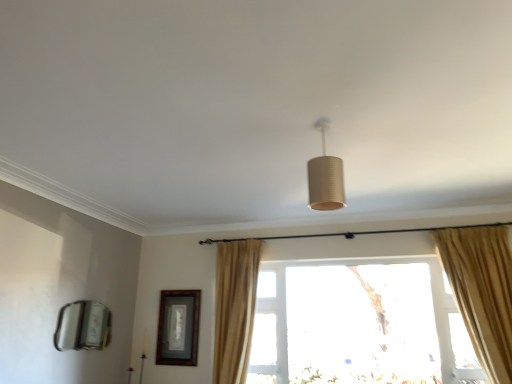
The image size is (512, 384). Describe the element at coordinates (234, 307) in the screenshot. I see `transparent glass window at center` at that location.

Where is `wooden framed picture at center left`? This screenshot has width=512, height=384. wooden framed picture at center left is located at coordinates (178, 327).

Which is behind, matte cardboard lampshade at center or transparent glass window at center?

transparent glass window at center is more distant.

Consider the image. Is matte cardboard lampshade at center facing towards transparent glass window at center?

No.

Can you confirm if matte cardboard lampshade at center is wider than transparent glass window at center?

Correct, the width of matte cardboard lampshade at center exceeds that of transparent glass window at center.

Is wooden framed picture at center left directly adjacent to beige fabric curtain at center?

There is a gap between wooden framed picture at center left and beige fabric curtain at center.

Which object is closer to the camera taking this photo, wooden framed picture at center left or beige fabric curtain at center?

Positioned in front is beige fabric curtain at center.

Considering the sizes of objects wooden framed picture at center left and beige fabric curtain at center in the image provided, who is smaller, wooden framed picture at center left or beige fabric curtain at center?

Smaller between the two is wooden framed picture at center left.

What's the angular difference between wooden framed picture at center left and beige fabric curtain at center's facing directions?

They differ by 0.857 degrees in their facing directions.

Is the depth of transparent glass window at center greater than that of wooden framed picture at center left?

No, transparent glass window at center is closer to the viewer.

From the image's perspective, is transparent glass window at center beneath wooden framed picture at center left?

No, from the image's perspective, transparent glass window at center is not beneath wooden framed picture at center left.

Does transparent glass window at center have a larger size compared to wooden framed picture at center left?

Yes.

In terms of height, does transparent glass window at center look taller or shorter compared to wooden framed picture at center left?

transparent glass window at center is taller than wooden framed picture at center left.

How different are the orientations of transparent glass window at center and matte cardboard lampshade at center in degrees?

The facing directions of transparent glass window at center and matte cardboard lampshade at center are 5.43 degrees apart.

Can you see transparent glass window at center touching matte cardboard lampshade at center?

No, transparent glass window at center is not next to matte cardboard lampshade at center.

Which point is more forward, (219, 313) or (324, 153)?

Positioned in front is point (324, 153).

Would you say transparent glass window at center is inside or outside matte cardboard lampshade at center?

The correct answer is: outside.

Which is more to the right, matte cardboard lampshade at center or wooden framed picture at center left?

From the viewer's perspective, matte cardboard lampshade at center appears more on the right side.

From the image's perspective, which is below, matte cardboard lampshade at center or wooden framed picture at center left?

wooden framed picture at center left appears lower in the image.

Considering the relative sizes of matte cardboard lampshade at center and wooden framed picture at center left in the image provided, is matte cardboard lampshade at center bigger than wooden framed picture at center left?

Result: Yes, matte cardboard lampshade at center is bigger than wooden framed picture at center left.

Looking at this image, can you confirm if matte cardboard lampshade at center is taller than wooden framed picture at center left?

No, matte cardboard lampshade at center is not taller than wooden framed picture at center left.

Is matte cardboard lampshade at center wider than beige fabric curtain at center?

No.

How different are the orientations of matte cardboard lampshade at center and beige fabric curtain at center in degrees?

The facing directions of matte cardboard lampshade at center and beige fabric curtain at center are 5.91 degrees apart.

Considering the positions of objects matte cardboard lampshade at center and beige fabric curtain at center in the image provided, who is more to the right, matte cardboard lampshade at center or beige fabric curtain at center?

matte cardboard lampshade at center.

Considering the relative sizes of matte cardboard lampshade at center and beige fabric curtain at center in the image provided, is matte cardboard lampshade at center shorter than beige fabric curtain at center?

Yes.

Could you tell me if beige fabric curtain at center is facing transparent glass window at center?

No, beige fabric curtain at center is not aimed at transparent glass window at center.

From the image's perspective, between beige fabric curtain at center and transparent glass window at center, which one is located above?

From the image's view, beige fabric curtain at center is above.

Identify the location of window lying on the right of beige fabric curtain at center. (234, 307).

From their relative heights in the image, would you say beige fabric curtain at center is taller or shorter than transparent glass window at center?

In the image, beige fabric curtain at center appears to be taller than transparent glass window at center.

The width and height of the screenshot is (512, 384). What are the coordinates of `window below the matte cardboard lampshade at center (from the image's perspective)` in the screenshot? It's located at tap(234, 307).

This screenshot has width=512, height=384. I want to click on curtain located on the right of wooden framed picture at center left, so click(x=234, y=308).

Looking at the image, which one is located further to beige fabric curtain at center, transparent glass window at center or matte cardboard lampshade at center?

The object further to beige fabric curtain at center is matte cardboard lampshade at center.

Considering their positions, is matte cardboard lampshade at center positioned further to wooden framed picture at center left than transparent glass window at center?

Among the two, matte cardboard lampshade at center is located further to wooden framed picture at center left.

From the image, which object appears to be nearer to beige fabric curtain at center, transparent glass window at center or wooden framed picture at center left?

Based on the image, transparent glass window at center appears to be nearer to beige fabric curtain at center.

Based on their spatial positions, is beige fabric curtain at center or matte cardboard lampshade at center further from transparent glass window at center?

Among the two, matte cardboard lampshade at center is located further to transparent glass window at center.

Considering their positions, is matte cardboard lampshade at center positioned closer to transparent glass window at center than beige fabric curtain at center?

beige fabric curtain at center lies closer to transparent glass window at center than the other object.

Based on their spatial positions, is beige fabric curtain at center or wooden framed picture at center left closer to transparent glass window at center?

beige fabric curtain at center.

From the image, which object appears to be nearer to beige fabric curtain at center, matte cardboard lampshade at center or transparent glass window at center?

Based on the image, transparent glass window at center appears to be nearer to beige fabric curtain at center.

Based on their spatial positions, is wooden framed picture at center left or transparent glass window at center further from beige fabric curtain at center?

Among the two, wooden framed picture at center left is located further to beige fabric curtain at center.

I want to click on curtain between wooden framed picture at center left and transparent glass window at center, so click(x=234, y=308).

The image size is (512, 384). I want to click on curtain between matte cardboard lampshade at center and transparent glass window at center along the z-axis, so click(234, 308).

The image size is (512, 384). Identify the location of curtain between matte cardboard lampshade at center and wooden framed picture at center left in the front-back direction. (234, 308).

Where is `window positioned between matte cardboard lampshade at center and wooden framed picture at center left from near to far`? The width and height of the screenshot is (512, 384). window positioned between matte cardboard lampshade at center and wooden framed picture at center left from near to far is located at coordinates (234, 307).